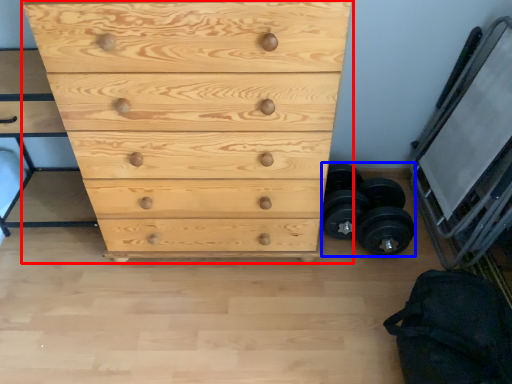
Question: Which of the following is the closest to the observer, chest of drawers (highlighted by a red box) or dumbbell (highlighted by a blue box)?

Choices:
 (A) chest of drawers
 (B) dumbbell

Answer: (A)